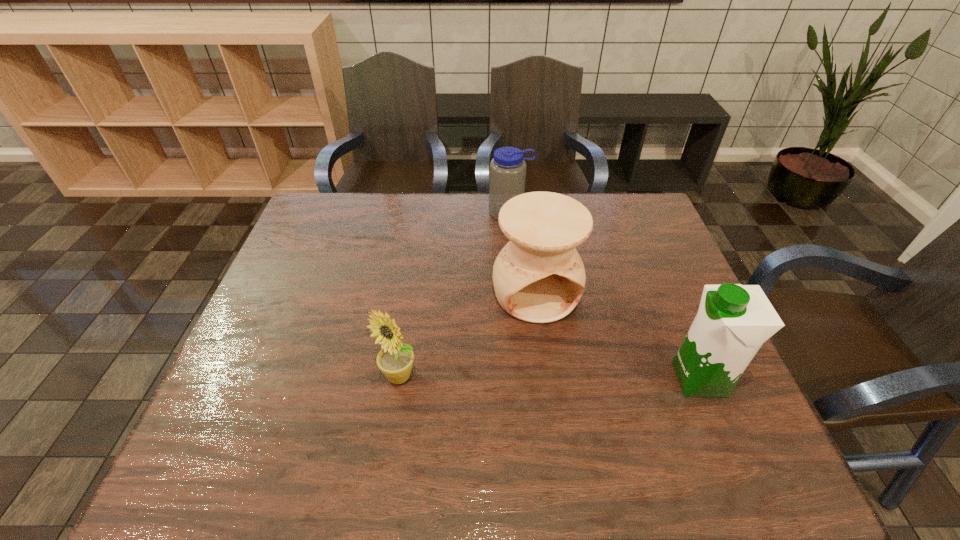
This screenshot has width=960, height=540. Identify the location of sunflower. point(395,360).

Find the location of `the rightmost object`. the rightmost object is located at coordinates (733, 321).

I want to click on the farthest object, so click(507, 170).

Locate an element on the screen. The width and height of the screenshot is (960, 540). the second farthest object is located at coordinates (539, 277).

Locate an element on the screen. vacant space located on the face of the sunflower is located at coordinates (393, 414).

Find the location of a particular element. The image size is (960, 540). free space located on the front-facing side of the rightmost object is located at coordinates (549, 379).

Find the location of a particular element. The height and width of the screenshot is (540, 960). free space located 0.180m on the front-facing side of the rightmost object is located at coordinates (593, 379).

In order to click on vacant space located 0.200m on the front-facing side of the rightmost object in this screenshot , I will do `click(584, 379)`.

The width and height of the screenshot is (960, 540). Find the location of `vacant space situated with a carrying loop on the side of the farthest object`. vacant space situated with a carrying loop on the side of the farthest object is located at coordinates (x=516, y=241).

Locate an element on the screen. vacant space located 0.360m with a carrying loop on the side of the farthest object is located at coordinates (532, 306).